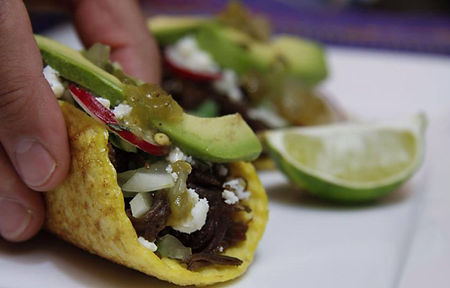
The width and height of the screenshot is (450, 288). Identify the location of table. (343, 233), (411, 81).